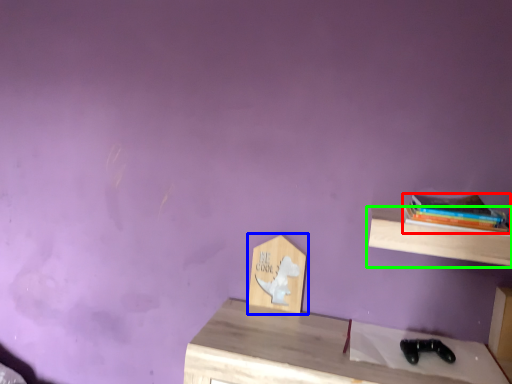
Question: Estimate the real-world distances between objects in this image. Which object is closer to book (highlighted by a red box), shelf (highlighted by a blue box) or shelf (highlighted by a green box)?

Choices:
 (A) shelf
 (B) shelf

Answer: (B)